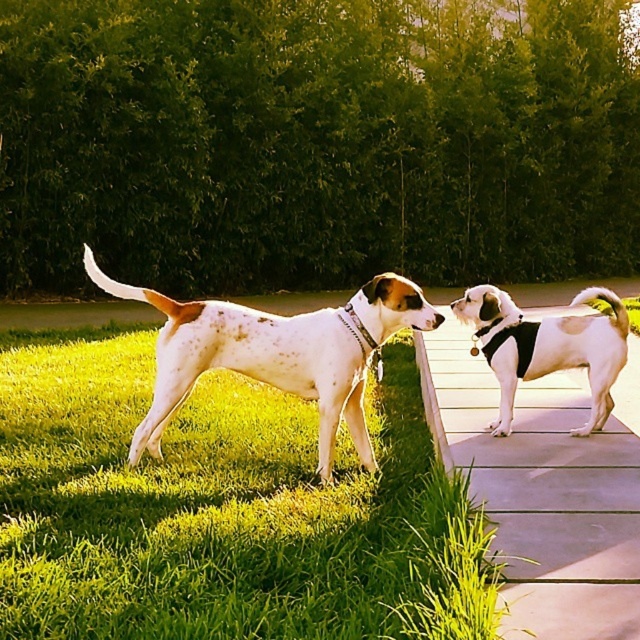
You are a dog trainer observing the two dogs in the scene. Which dog is taller between the speckled white dog at center and the white speckled fur at right?

→ The speckled white dog at center is taller than the white speckled fur at right according to the description.

You are a photographer standing in the park. You want to take a photo of both the speckled white dog at center and the white speckled fur at right. Which dog should you focus on first to ensure both are in the frame?

You should focus on the speckled white dog at center first since it is closer to the viewer than the white speckled fur at right, allowing both to be captured in the frame by adjusting the camera angle accordingly.